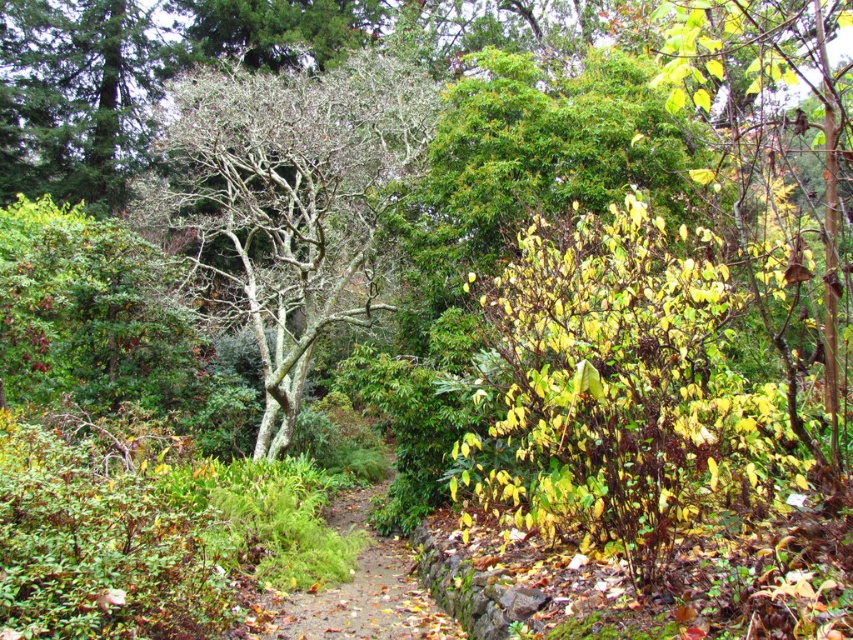
Question: Is white bark tree at center to the right of brown dirt path at center from the viewer's perspective?

Choices:
 (A) no
 (B) yes

Answer: (A)

Question: Does white bark tree at center come behind brown dirt path at center?

Choices:
 (A) yes
 (B) no

Answer: (A)

Question: Which point appears closest to the camera in this image?

Choices:
 (A) (386, 84)
 (B) (345, 516)

Answer: (B)

Question: Which point is closer to the camera taking this photo?

Choices:
 (A) (236, 250)
 (B) (361, 509)

Answer: (B)

Question: Can you confirm if white bark tree at center is positioned above brown dirt path at center?

Choices:
 (A) no
 (B) yes

Answer: (B)